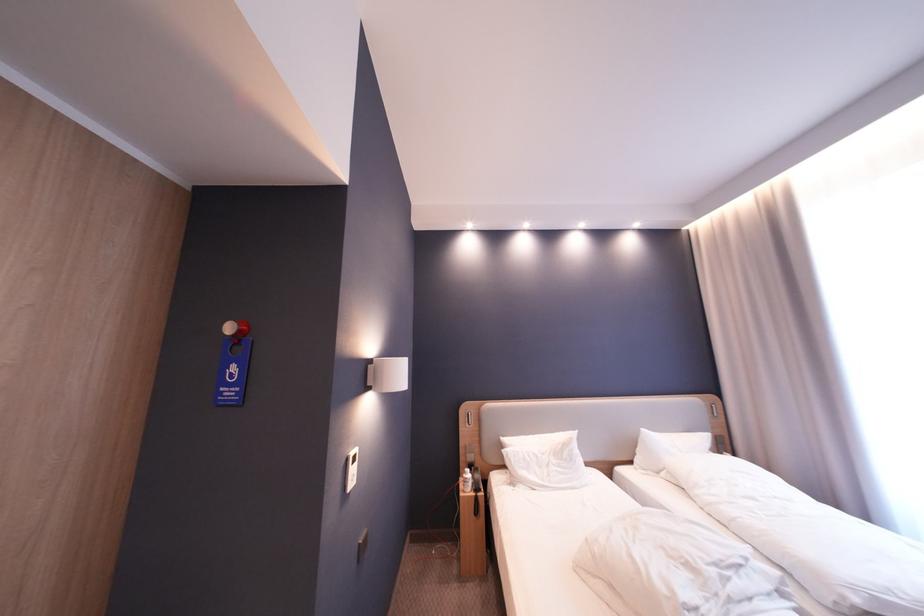
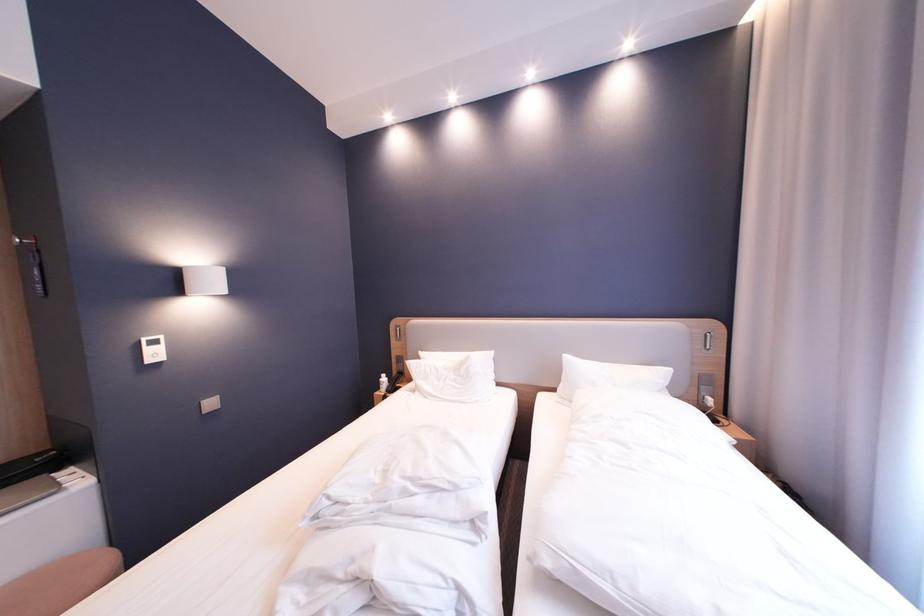
Locate, in the second image, the point that corresponds to pixel 641 464 in the first image.

(565, 391)